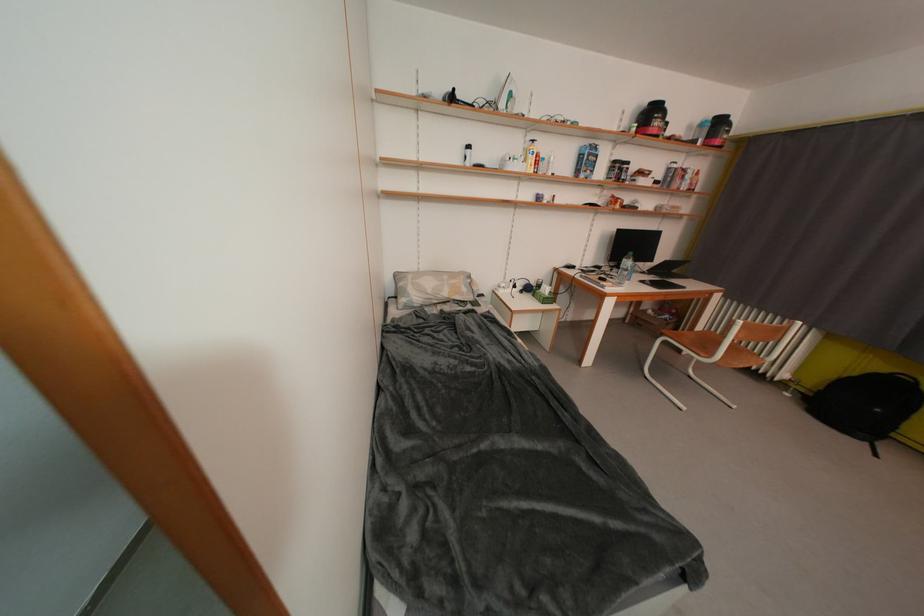
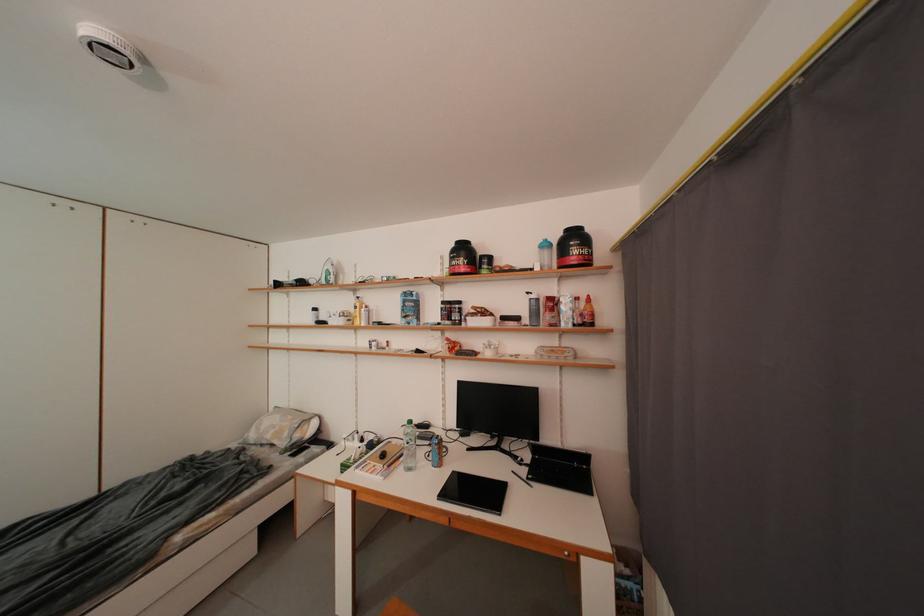
Locate, in the second image, the point that corresponds to the point at 699,187 in the first image.

(590, 318)